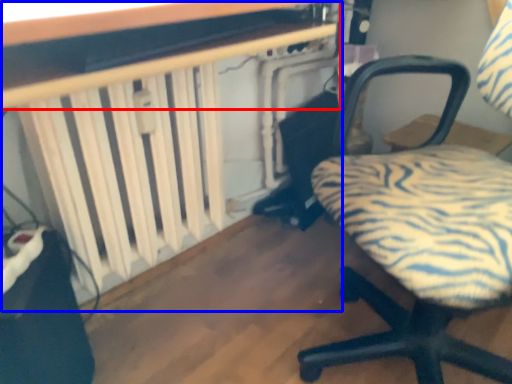
Question: Which point is closer to the camera, table (highlighted by a red box) or table (highlighted by a blue box)?

Choices:
 (A) table
 (B) table

Answer: (A)